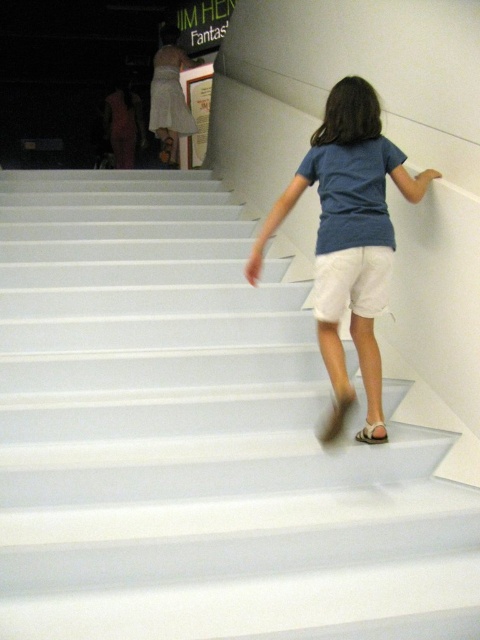
Question: Which point is farther to the camera?

Choices:
 (A) (336, 224)
 (B) (369, 275)
 (C) (180, 589)

Answer: (B)

Question: Does blue cotton shirt at center have a larger size compared to white fabric sandal at lower center?

Choices:
 (A) yes
 (B) no

Answer: (A)

Question: Is white glossy stairs at center smaller than white cotton shorts at center?

Choices:
 (A) no
 (B) yes

Answer: (A)

Question: Considering the real-world distances, which object is closest to the blue cotton shirt at center?

Choices:
 (A) white fabric sandal at lower center
 (B) white cotton shorts at center
 (C) white glossy stairs at center

Answer: (B)

Question: In this image, where is white glossy stairs at center located relative to blue cotton shirt at center?

Choices:
 (A) above
 (B) below

Answer: (B)

Question: Which of the following is the closest to the observer?

Choices:
 (A) blue cotton shirt at center
 (B) white cotton shorts at center
 (C) white fabric sandal at lower center
 (D) white glossy stairs at center

Answer: (D)